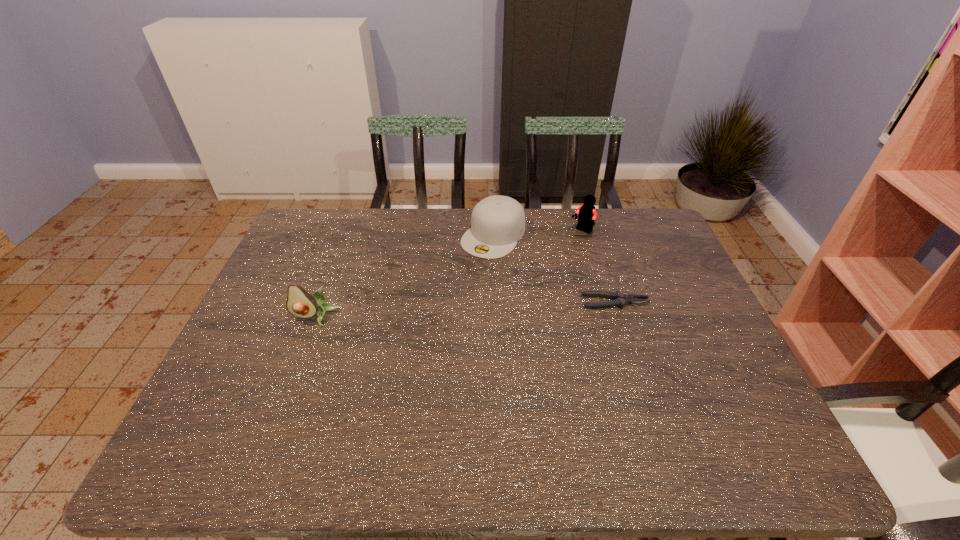
This screenshot has height=540, width=960. What are the coordinates of `vacant region between the avocado and the pliers` in the screenshot? It's located at (466, 309).

Locate an element on the screen. empty space between the shortest object and the avocado is located at coordinates (466, 309).

Identify the location of object that is the third closest to the avocado. The image size is (960, 540). (587, 214).

Locate an element on the screen. object that is the third closest to the Lego is located at coordinates (300, 303).

Locate an element on the screen. vacant space that satisfies the following two spatial constraints: 1. on the front side of the Lego; 2. at the gripping part of the pliers is located at coordinates (602, 302).

I want to click on vacant space that satisfies the following two spatial constraints: 1. on the front side of the shortest object; 2. at the gripping part of the Lego, so click(602, 302).

The width and height of the screenshot is (960, 540). I want to click on blank space that satisfies the following two spatial constraints: 1. on the front side of the pliers; 2. at the gripping part of the cap, so click(x=496, y=302).